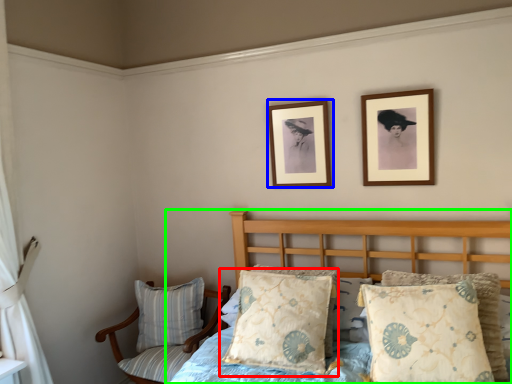
Question: Which is farther away from pillow (highlighted by a red box)? picture frame (highlighted by a blue box) or bed (highlighted by a green box)?

Choices:
 (A) picture frame
 (B) bed

Answer: (A)